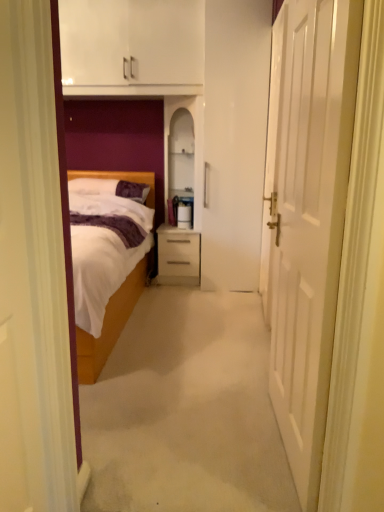
Question: Does wooden bed at left have a smaller size compared to white matte door at right?

Choices:
 (A) yes
 (B) no

Answer: (B)

Question: Is wooden bed at left to the right of white matte door at right from the viewer's perspective?

Choices:
 (A) yes
 (B) no

Answer: (B)

Question: Is wooden bed at left bigger than white matte door at right?

Choices:
 (A) no
 (B) yes

Answer: (B)

Question: From a real-world perspective, is wooden bed at left below white matte door at right?

Choices:
 (A) no
 (B) yes

Answer: (B)

Question: Is wooden bed at left positioned with its back to white matte door at right?

Choices:
 (A) yes
 (B) no

Answer: (B)

Question: Looking at the image, does white matte door at right seem bigger or smaller compared to white soft pillow at center?

Choices:
 (A) big
 (B) small

Answer: (A)

Question: From their relative heights in the image, would you say white matte door at right is taller or shorter than white soft pillow at center?

Choices:
 (A) short
 (B) tall

Answer: (B)

Question: Considering the positions of white matte door at right and white soft pillow at center in the image, is white matte door at right wider or thinner than white soft pillow at center?

Choices:
 (A) wide
 (B) thin

Answer: (B)

Question: Considering the relative positions of white matte door at right and white soft pillow at center in the image provided, is white matte door at right to the left or to the right of white soft pillow at center?

Choices:
 (A) left
 (B) right

Answer: (B)

Question: From a real-world perspective, is wooden bed at left above or below white matte door at right?

Choices:
 (A) below
 (B) above

Answer: (A)

Question: From the image's perspective, relative to white matte door at right, is wooden bed at left above or below?

Choices:
 (A) below
 (B) above

Answer: (A)

Question: Considering the relative positions of wooden bed at left and white matte door at right in the image provided, is wooden bed at left to the left or to the right of white matte door at right?

Choices:
 (A) right
 (B) left

Answer: (B)

Question: Considering their positions, is wooden bed at left located in front of or behind white matte door at right?

Choices:
 (A) behind
 (B) front

Answer: (A)

Question: Is white matte door at right inside or outside of matte white drawer at center?

Choices:
 (A) outside
 (B) inside

Answer: (A)

Question: Is white matte door at right wider or thinner than matte white drawer at center?

Choices:
 (A) wide
 (B) thin

Answer: (B)